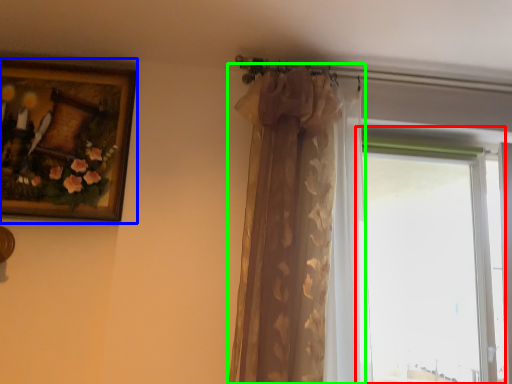
Question: Which is farther away from window (highlighted by a red box)? picture frame (highlighted by a blue box) or curtain (highlighted by a green box)?

Choices:
 (A) picture frame
 (B) curtain

Answer: (A)